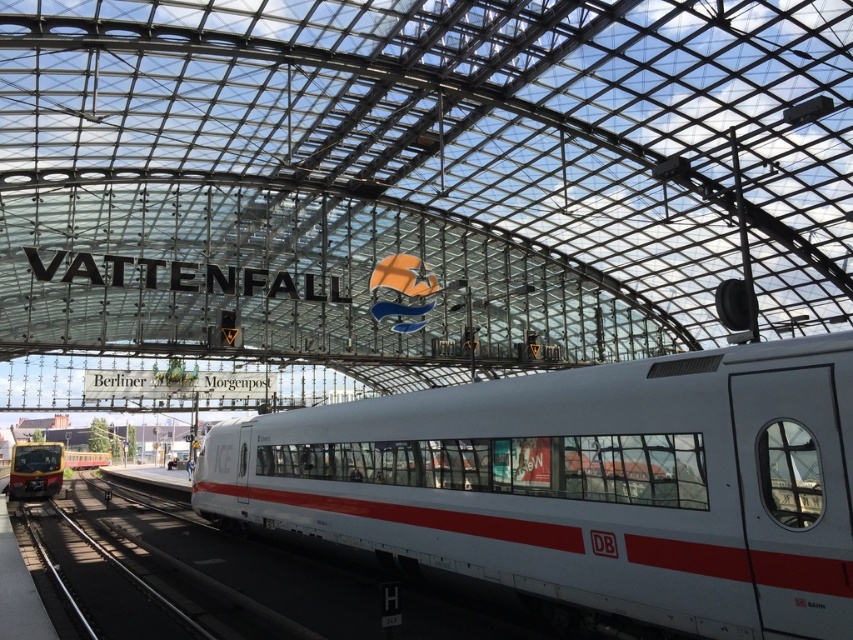
Does white glossy train at center have a larger size compared to matte black train at lower left?

Correct, white glossy train at center is larger in size than matte black train at lower left.

Who is higher up, white glossy train at center or matte black train at lower left?

white glossy train at center

Measure the distance between point (596, 488) and camera.

9.54 meters

Identify the location of white glossy train at center. (585, 484).